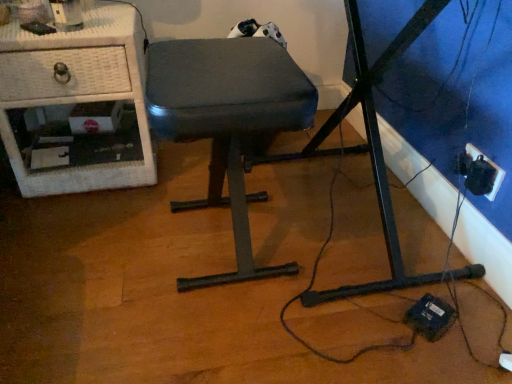
Locate an element on the screen. The image size is (512, 384). vacant area that is in front of dark gray fabric stool at center is located at coordinates coord(203,341).